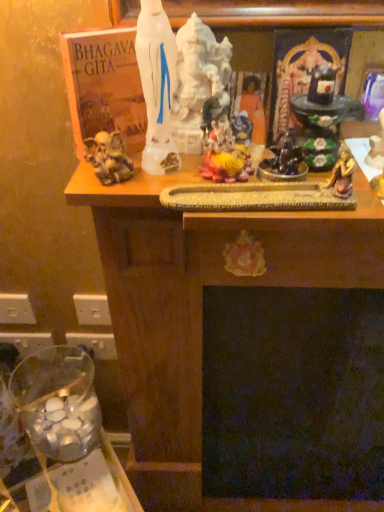
Question: Should I look upward or downward to see white glossy statue at upper center?

Choices:
 (A) down
 (B) up

Answer: (B)

Question: Should I look upward or downward to see matte orange statue at center?

Choices:
 (A) down
 (B) up

Answer: (B)

Question: Can you confirm if clear glass jar at lower left is taller than white glossy statue at upper center?

Choices:
 (A) yes
 (B) no

Answer: (B)

Question: Is clear glass jar at lower left bigger than white glossy statue at upper center?

Choices:
 (A) no
 (B) yes

Answer: (B)

Question: Does clear glass jar at lower left come in front of white glossy statue at upper center?

Choices:
 (A) yes
 (B) no

Answer: (B)

Question: From a real-world perspective, is clear glass jar at lower left physically below white glossy statue at upper center?

Choices:
 (A) no
 (B) yes

Answer: (B)

Question: Is clear glass jar at lower left behind white glossy statue at upper center?

Choices:
 (A) yes
 (B) no

Answer: (A)

Question: Is clear glass jar at lower left to the left of white glossy statue at upper center from the viewer's perspective?

Choices:
 (A) yes
 (B) no

Answer: (A)

Question: Is white glossy statue at upper center surrounded by matte orange statue at center?

Choices:
 (A) no
 (B) yes

Answer: (A)

Question: Is matte orange statue at center facing towards white glossy statue at upper center?

Choices:
 (A) yes
 (B) no

Answer: (B)

Question: Is white glossy statue at upper center at the back of matte orange statue at center?

Choices:
 (A) no
 (B) yes

Answer: (A)

Question: From the image's perspective, is matte orange statue at center located beneath white glossy statue at upper center?

Choices:
 (A) no
 (B) yes

Answer: (B)

Question: Does matte orange statue at center appear on the right side of white glossy statue at upper center?

Choices:
 (A) no
 (B) yes

Answer: (B)

Question: From a real-world perspective, is matte orange statue at center positioned over white glossy statue at upper center based on gravity?

Choices:
 (A) no
 (B) yes

Answer: (A)

Question: From the image's perspective, is white glossy statue at upper center over matte orange statue at center?

Choices:
 (A) yes
 (B) no

Answer: (A)